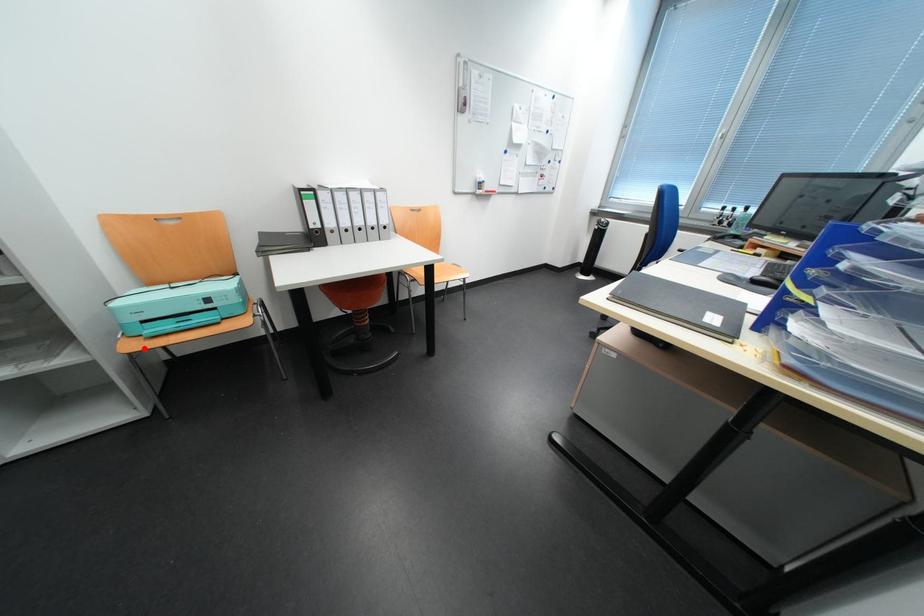
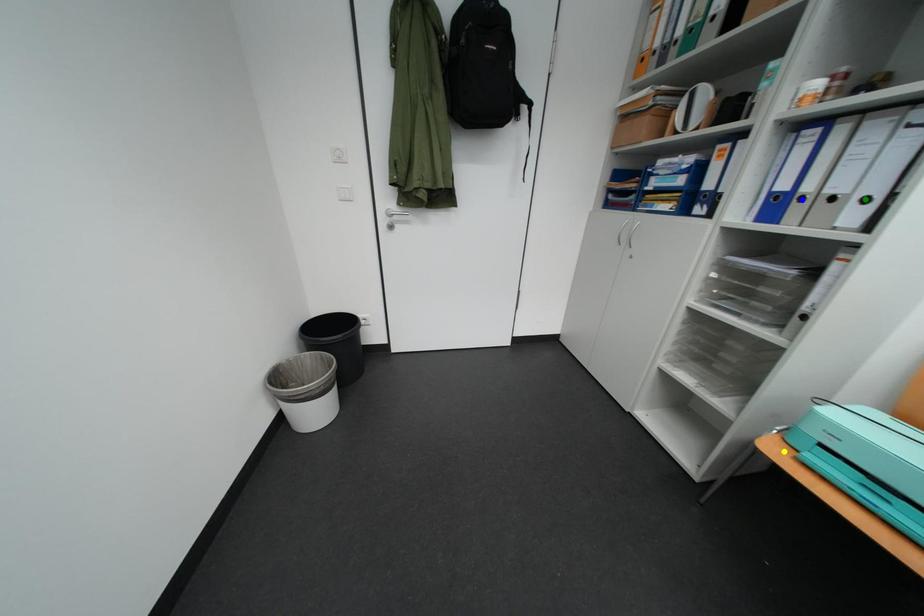
Question: I am providing you with two images of the same scene from different viewpoints. A red point is marked on the first image. You are given multiple points on the second image. In image 2, which mark is for the same physical point as the one in image 1?

Choices:
 (A) blue point
 (B) yellow point
 (C) green point

Answer: (B)